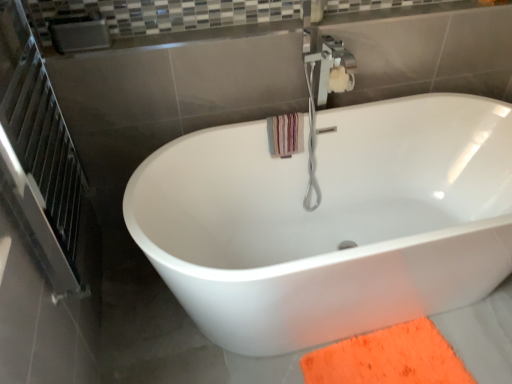
What do you see at coordinates (388, 358) in the screenshot? The image size is (512, 384). I see `orange fuzzy doormat at lower right` at bounding box center [388, 358].

The width and height of the screenshot is (512, 384). I want to click on metallic silver screen door at left, so click(39, 157).

You are a GUI agent. You are given a task and a screenshot of the screen. Output one action in this format:
    pyautogui.click(x=<x>, y=<y>)
    Task: Click on the brushed metal balustrade at upper center
    The image size is (512, 384).
    Given the screenshot: What is the action you would take?
    pyautogui.click(x=168, y=18)

In order to face white glossy bathtub at center, should I rotate leftwards or rightwards?

You should look right and rotate roughly 12.745 degrees.

Identify the location of orange fuzzy doormat at lower right. (388, 358).

Considering the positions of objects brushed metal balustrade at upper center and orange fuzzy doormat at lower right in the image provided, who is more to the right, brushed metal balustrade at upper center or orange fuzzy doormat at lower right?

orange fuzzy doormat at lower right is more to the right.

Which of these two, brushed metal balustrade at upper center or orange fuzzy doormat at lower right, is wider?

orange fuzzy doormat at lower right.

What's the angular difference between brushed metal balustrade at upper center and orange fuzzy doormat at lower right's facing directions?

The facing directions of brushed metal balustrade at upper center and orange fuzzy doormat at lower right are 0.181 degrees apart.

Is white glossy bathtub at center spatially inside metallic silver screen door at left, or outside of it?

The correct answer is: outside.

How different are the orientations of white glossy bathtub at center and metallic silver screen door at left in degrees?

There is a 88.9-degree angle between the facing directions of white glossy bathtub at center and metallic silver screen door at left.

In the image, is white glossy bathtub at center on the left side or the right side of metallic silver screen door at left?

white glossy bathtub at center is to the right of metallic silver screen door at left.

From a real-world perspective, who is located higher, white glossy bathtub at center or metallic silver screen door at left?

metallic silver screen door at left is physically above.

From a real-world perspective, does orange fuzzy doormat at lower right stand above striped cotton beach towel at upper right?

Actually, orange fuzzy doormat at lower right is physically below striped cotton beach towel at upper right in the real world.

Does orange fuzzy doormat at lower right have a lesser width compared to striped cotton beach towel at upper right?

In fact, orange fuzzy doormat at lower right might be wider than striped cotton beach towel at upper right.

Is striped cotton beach towel at upper right a part of orange fuzzy doormat at lower right?

No.

From the image's perspective, who appears lower, orange fuzzy doormat at lower right or striped cotton beach towel at upper right?

orange fuzzy doormat at lower right, from the image's perspective.

Is metallic silver screen door at left inside the boundaries of white glossy bathtub at center, or outside?

metallic silver screen door at left is spatially situated outside white glossy bathtub at center.

Which object is positioned more to the left, metallic silver screen door at left or white glossy bathtub at center?

From the viewer's perspective, metallic silver screen door at left appears more on the left side.

Between metallic silver screen door at left and white glossy bathtub at center, which one has smaller size?

With smaller size is metallic silver screen door at left.

In terms of height, does metallic silver screen door at left look taller or shorter compared to white glossy bathtub at center?

metallic silver screen door at left is taller than white glossy bathtub at center.

From the image's perspective, would you say brushed metal balustrade at upper center is shown under striped cotton beach towel at upper right?

No, from the image's perspective, brushed metal balustrade at upper center is not beneath striped cotton beach towel at upper right.

Which object is positioned more to the left, brushed metal balustrade at upper center or striped cotton beach towel at upper right?

Positioned to the left is striped cotton beach towel at upper right.

Considering the sizes of objects brushed metal balustrade at upper center and striped cotton beach towel at upper right in the image provided, who is shorter, brushed metal balustrade at upper center or striped cotton beach towel at upper right?

brushed metal balustrade at upper center.

Between brushed metal balustrade at upper center and striped cotton beach towel at upper right, which one is positioned in front?

brushed metal balustrade at upper center is more forward.

Consider the image. Is the depth of brushed metal balustrade at upper center greater than that of white glossy bathtub at center?

Yes.

Locate an element on the screen. Image resolution: width=512 pixels, height=384 pixels. balustrade behind the white glossy bathtub at center is located at coordinates (168, 18).

Based on the photo, can you tell me how much brushed metal balustrade at upper center and white glossy bathtub at center differ in facing direction?

They differ by 0.181 degrees in their facing directions.

Is brushed metal balustrade at upper center positioned beyond the bounds of white glossy bathtub at center?

Yes, brushed metal balustrade at upper center is not within white glossy bathtub at center.

From the image's perspective, which one is positioned higher, striped cotton beach towel at upper right or white glossy bathtub at center?

striped cotton beach towel at upper right.

Which of these two, striped cotton beach towel at upper right or white glossy bathtub at center, is smaller?

Smaller between the two is striped cotton beach towel at upper right.

Which point is more distant from viewer, (280, 148) or (267, 294)?

The point (280, 148) is behind.

Can you tell me how much striped cotton beach towel at upper right and white glossy bathtub at center differ in facing direction?

The angular difference between striped cotton beach towel at upper right and white glossy bathtub at center is 0.0016 degrees.

Find the location of `balustrade located above the orange fuzzy doormat at lower right (from a real-world perspective)`. balustrade located above the orange fuzzy doormat at lower right (from a real-world perspective) is located at coordinates (168, 18).

The image size is (512, 384). Find the location of `bathtub that appears below the metallic silver screen door at left (from the image's perspective)`. bathtub that appears below the metallic silver screen door at left (from the image's perspective) is located at coordinates (331, 221).

Estimate the real-world distances between objects in this image. Which object is closer to white glossy bathtub at center, striped cotton beach towel at upper right or brushed metal balustrade at upper center?

striped cotton beach towel at upper right is positioned closer to the anchor white glossy bathtub at center.

Based on their spatial positions, is brushed metal balustrade at upper center or metallic silver screen door at left further from white glossy bathtub at center?

The object further to white glossy bathtub at center is brushed metal balustrade at upper center.

From the image, which object appears to be nearer to orange fuzzy doormat at lower right, white glossy bathtub at center or brushed metal balustrade at upper center?

white glossy bathtub at center lies closer to orange fuzzy doormat at lower right than the other object.

When comparing their distances from metallic silver screen door at left, does striped cotton beach towel at upper right or brushed metal balustrade at upper center seem closer?

Based on the image, brushed metal balustrade at upper center appears to be nearer to metallic silver screen door at left.

When comparing their distances from white glossy bathtub at center, does metallic silver screen door at left or orange fuzzy doormat at lower right seem closer?

orange fuzzy doormat at lower right is positioned closer to the anchor white glossy bathtub at center.

From the image, which object appears to be nearer to striped cotton beach towel at upper right, orange fuzzy doormat at lower right or white glossy bathtub at center?

white glossy bathtub at center is closer to striped cotton beach towel at upper right.

Looking at the image, which one is located further to white glossy bathtub at center, metallic silver screen door at left or brushed metal balustrade at upper center?

brushed metal balustrade at upper center is positioned further to the anchor white glossy bathtub at center.

Looking at the image, which one is located closer to metallic silver screen door at left, brushed metal balustrade at upper center or white glossy bathtub at center?

→ brushed metal balustrade at upper center lies closer to metallic silver screen door at left than the other object.

Locate an element on the screen. This screenshot has width=512, height=384. screen door between brushed metal balustrade at upper center and orange fuzzy doormat at lower right from top to bottom is located at coordinates (39, 157).

Locate an element on the screen. bathtub located between metallic silver screen door at left and orange fuzzy doormat at lower right in the left-right direction is located at coordinates (331, 221).

At what (x,y) coordinates should I click in order to perform the action: click on bathtub between striped cotton beach towel at upper right and orange fuzzy doormat at lower right vertically. Please return your answer as a coordinate pair (x, y). This screenshot has height=384, width=512. Looking at the image, I should click on (331, 221).

Find the location of a particular element. This screenshot has width=512, height=384. bathtub between brushed metal balustrade at upper center and orange fuzzy doormat at lower right in the up-down direction is located at coordinates (331, 221).